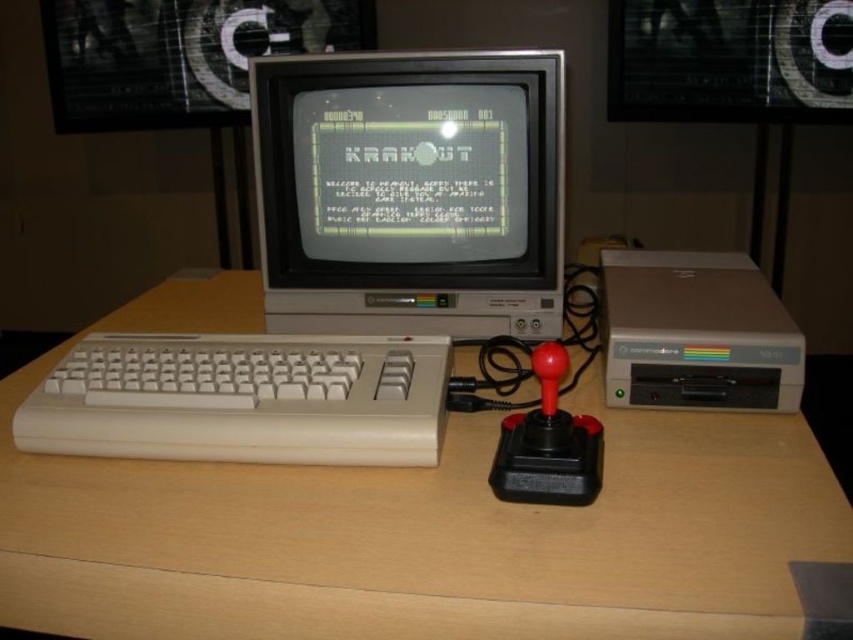
Question: Is white plastic keyboard at lower left bigger than matte gray floppy disk drive at center right?

Choices:
 (A) no
 (B) yes

Answer: (A)

Question: Can you confirm if light brown wood at center is bigger than white plastic keyboard at lower left?

Choices:
 (A) yes
 (B) no

Answer: (A)

Question: Estimate the real-world distances between objects in this image. Which object is farther from the matte gray floppy disk drive at center right?

Choices:
 (A) light brown wood at center
 (B) gray plastic monitor at center
 (C) white plastic keyboard at lower left

Answer: (C)

Question: Which point appears closest to the camera in this image?

Choices:
 (A) (442, 116)
 (B) (151, 388)
 (C) (517, 604)
 (D) (625, 387)

Answer: (C)

Question: Does light brown wood at center appear under gray plastic monitor at center?

Choices:
 (A) yes
 (B) no

Answer: (A)

Question: Considering the real-world distances, which object is closest to the white plastic keyboard at lower left?

Choices:
 (A) gray plastic monitor at center
 (B) light brown wood at center
 (C) matte gray floppy disk drive at center right

Answer: (B)